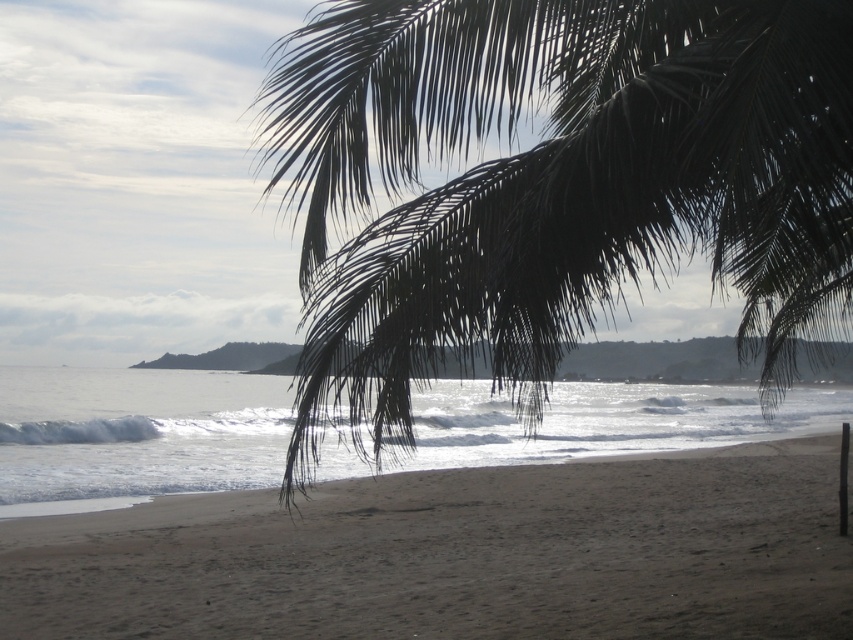
Consider the image. You are standing on the beach looking towards the ocean. You see the green leafy palm tree at upper right and the dark brown sand at lower center. Which object is higher up in the image?

The green leafy palm tree at upper right is located above the dark brown sand at lower center, so it is higher up in the image.

You are standing on the beach and want to take a photo of the dark brown sand at lower center without the green leafy palm tree at upper right blocking it. Which direction should you move to ensure the palm tree is out of the frame?

Move to the left or right to position yourself so the green leafy palm tree at upper right is no longer in front of the dark brown sand at lower center.

You are standing at the beach and see two points marked on the sand. The first is at point (550,314) and the second is at point (669,608). Which point is closer to you?

Point (550,314) is in front of point (669,608), so it is closer to you.